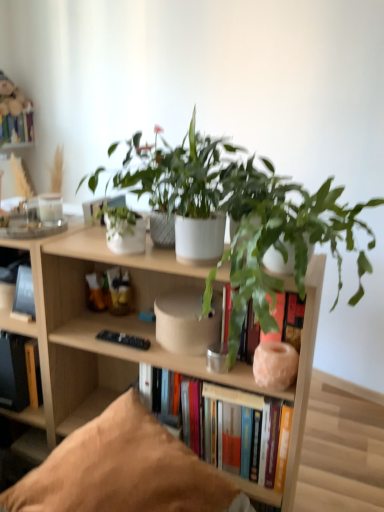
The image size is (384, 512). What do you see at coordinates (282, 236) in the screenshot?
I see `green matte plant at center, which ranks as the second houseplant in left-to-right order` at bounding box center [282, 236].

How much space does black matte book at left, positioned as the second book in front-to-back order, occupy horizontally?

black matte book at left, positioned as the second book in front-to-back order, is 2.74 inches wide.

Measure the distance between point (161,176) and camera.

The distance of point (161,176) from camera is 4.02 feet.

Describe the element at coordinates (130, 333) in the screenshot. I see `wooden bookcase at center` at that location.

Find the location of a particular element. matte pink stone vase at center is located at coordinates (275, 365).

Locate an element on the screen. green matte plant at center, positioned as the 1th houseplant in right-to-left order is located at coordinates (282, 236).

Does hardcover books at center, the 1th book in the right-to-left sequence, come behind matte pink stone vase at center?

Yes, the depth of hardcover books at center, the 1th book in the right-to-left sequence, is greater than that of matte pink stone vase at center.

From the image's perspective, relative to matte pink stone vase at center, is hardcover books at center, which is the fourth book in top-to-bottom order, above or below?

From the image's perspective, hardcover books at center, which is the fourth book in top-to-bottom order, appears below matte pink stone vase at center.

In terms of width, does hardcover books at center, acting as the fourth book starting from the left, look wider or thinner when compared to matte pink stone vase at center?

In the image, hardcover books at center, acting as the fourth book starting from the left, appears to be wider than matte pink stone vase at center.

Considering the positions of objects hardcover books at center, the fourth book from the back, and matte pink stone vase at center in the image provided, who is more to the right, hardcover books at center, the fourth book from the back, or matte pink stone vase at center?

matte pink stone vase at center is more to the right.

From a real-world perspective, is matte pink stone vase at center over white matte pot at upper center, which is counted as the 1th houseplant, starting from the left?

No, from a real-world perspective, matte pink stone vase at center is not over white matte pot at upper center, which is counted as the 1th houseplant, starting from the left

Are matte pink stone vase at center and white matte pot at upper center, which is counted as the 1th houseplant, starting from the left, beside each other?

No.

Is matte pink stone vase at center oriented away from white matte pot at upper center, which is the second houseplant in right-to-left order?

No, white matte pot at upper center, which is the second houseplant in right-to-left order, is not at the back of matte pink stone vase at center.

Is matte pink stone vase at center thinner than white matte pot at upper center, which is the second houseplant in right-to-left order?

Yes, matte pink stone vase at center is thinner than white matte pot at upper center, which is the second houseplant in right-to-left order.

In the scene shown: Measure the distance from white matte pot at upper center, which is counted as the 1th houseplant, starting from the left, to matte pink stone vase at center.

white matte pot at upper center, which is counted as the 1th houseplant, starting from the left, is 16.83 inches from matte pink stone vase at center.

In the scene shown: In terms of height, does white matte pot at upper center, which is the second houseplant in right-to-left order, look taller or shorter compared to matte pink stone vase at center?

In the image, white matte pot at upper center, which is the second houseplant in right-to-left order, appears to be taller than matte pink stone vase at center.

Is white matte pot at upper center, which is counted as the 1th houseplant, starting from the left, next to matte pink stone vase at center and touching it?

No.

Considering the positions of objects white matte pot at upper center, which is the second houseplant in right-to-left order, and matte pink stone vase at center in the image provided, who is more to the left, white matte pot at upper center, which is the second houseplant in right-to-left order, or matte pink stone vase at center?

white matte pot at upper center, which is the second houseplant in right-to-left order.

Which object is positioned more to the right, hardcover book at upper left, placed as the fourth book when sorted from bottom to top, or brown fabric pillow at lower center?

brown fabric pillow at lower center is more to the right.

Can you confirm if hardcover book at upper left, the fourth book when ordered from right to left, is smaller than brown fabric pillow at lower center?

Yes.

Find the location of a particular element. pillow located underneath the hardcover book at upper left, arranged as the first book when viewed from the top (from a real-world perspective) is located at coordinates (123, 470).

From a real-world perspective, is hardcover book at upper left, arranged as the first book when viewed from the top, positioned above or below brown fabric pillow at lower center?

hardcover book at upper left, arranged as the first book when viewed from the top, is situated higher than brown fabric pillow at lower center in the real world.

Between point (116, 388) and point (346, 233), which one is positioned in front?

The point (346, 233) is more forward.

Based on the photo, is wooden bookcase at center oriented towards green matte plant at center, which ranks as the second houseplant in left-to-right order?

No, wooden bookcase at center does not turn towards green matte plant at center, which ranks as the second houseplant in left-to-right order.

The height and width of the screenshot is (512, 384). Identify the location of the 1st houseplant above the wooden bookcase at center (from the image's perspective). (282, 236).

From a real-world perspective, count 2nd houseplants upward from the brown fabric pillow at lower center and point to it. Please provide its 2D coordinates.

[(181, 186)]

Between point (215, 208) and point (169, 471), which one is positioned behind?

Positioned behind is point (215, 208).

Choose the correct answer: Is white matte pot at upper center, which is the second houseplant in right-to-left order, inside brown fabric pillow at lower center or outside it?

white matte pot at upper center, which is the second houseplant in right-to-left order, is located beyond the bounds of brown fabric pillow at lower center.

Does white matte pot at upper center, which is the second houseplant in right-to-left order, have a smaller size compared to brown fabric pillow at lower center?

Indeed, white matte pot at upper center, which is the second houseplant in right-to-left order, has a smaller size compared to brown fabric pillow at lower center.

Which object is thinner, green matte plant at center, positioned as the 1th houseplant in right-to-left order, or brown fabric pillow at lower center?

With smaller width is brown fabric pillow at lower center.

From the image's perspective, which one is positioned higher, green matte plant at center, positioned as the 1th houseplant in right-to-left order, or brown fabric pillow at lower center?

green matte plant at center, positioned as the 1th houseplant in right-to-left order.

Which point is more distant from viewer, [231,162] or [102,493]?

Positioned behind is point [231,162].

Considering the relative positions of green matte plant at center, which ranks as the second houseplant in left-to-right order, and brown fabric pillow at lower center in the image provided, is green matte plant at center, which ranks as the second houseplant in left-to-right order, to the left or to the right of brown fabric pillow at lower center?

In the image, green matte plant at center, which ranks as the second houseplant in left-to-right order, appears on the right side of brown fabric pillow at lower center.

Where is `vase that appears above the hardcover books at center, arranged as the 1th book when ordered from the bottom (from a real-world perspective)`? vase that appears above the hardcover books at center, arranged as the 1th book when ordered from the bottom (from a real-world perspective) is located at coordinates (275, 365).

The image size is (384, 512). In order to click on vase behind the white matte pot at upper center, which is the second houseplant in right-to-left order in this screenshot , I will do `click(275, 365)`.

Which object lies nearer to the anchor point hardcover book at left, the second book when ordered from back to front, brown fabric pillow at lower center or green matte plant at center, positioned as the 1th houseplant in right-to-left order?

Based on the image, brown fabric pillow at lower center appears to be nearer to hardcover book at left, the second book when ordered from back to front.

Looking at the image, which one is located closer to brown fabric pillow at lower center, black matte book at left, which ranks as the third book in bottom-to-top order, or hardcover books at center, which is counted as the first book, starting from the front?

Based on the image, hardcover books at center, which is counted as the first book, starting from the front, appears to be nearer to brown fabric pillow at lower center.

Based on their spatial positions, is wooden bookcase at center or hardcover book at upper left, arranged as the first book when viewed from the top, further from hardcover book at left, the 2th book ordered from the bottom?

hardcover book at upper left, arranged as the first book when viewed from the top.

Looking at the image, which one is located further to brown fabric pillow at lower center, black matte book at left, arranged as the second book when viewed from the top, or wooden bookcase at center?

Based on the image, black matte book at left, arranged as the second book when viewed from the top, appears to be further to brown fabric pillow at lower center.

From the image, which object appears to be nearer to hardcover book at left, arranged as the third book when viewed from the front, matte pink stone vase at center or brown fabric pillow at lower center?

Based on the image, brown fabric pillow at lower center appears to be nearer to hardcover book at left, arranged as the third book when viewed from the front.

Based on their spatial positions, is black matte book at left, which ranks as the third book in bottom-to-top order, or brown fabric pillow at lower center further from white matte pot at upper center, which is the second houseplant in right-to-left order?

black matte book at left, which ranks as the third book in bottom-to-top order, is positioned further to the anchor white matte pot at upper center, which is the second houseplant in right-to-left order.

Based on their spatial positions, is black matte book at left, which ranks as the third book in bottom-to-top order, or brown fabric pillow at lower center further from wooden bookcase at center?

The object further to wooden bookcase at center is black matte book at left, which ranks as the third book in bottom-to-top order.

When comparing their distances from green matte plant at center, which ranks as the second houseplant in left-to-right order, does brown fabric pillow at lower center or hardcover book at upper left, placed as the fourth book when sorted from bottom to top, seem further?

The object further to green matte plant at center, which ranks as the second houseplant in left-to-right order, is hardcover book at upper left, placed as the fourth book when sorted from bottom to top.

Find the location of a particular element. vase between white matte pot at upper center, which is counted as the 1th houseplant, starting from the left, and brown fabric pillow at lower center, in the vertical direction is located at coordinates (275, 365).

I want to click on pillow between wooden bookcase at center and matte pink stone vase at center from left to right, so click(x=123, y=470).

You are a GUI agent. You are given a task and a screenshot of the screen. Output one action in this format:
    pyautogui.click(x=<x>, y=<y>)
    Task: Click on the book situated between wooden bookcase at center and green matte plant at center, positioned as the 1th houseplant in right-to-left order, from left to right
    
    Given the screenshot: What is the action you would take?
    pyautogui.click(x=236, y=404)

Locate an element on the screen. This screenshot has height=512, width=384. bookcase located between black matte book at left, arranged as the second book when viewed from the top, and hardcover books at center, the 1th book in the right-to-left sequence, in the left-right direction is located at coordinates (130, 333).